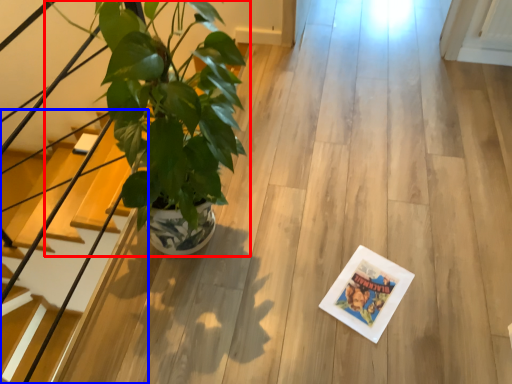
Question: Among these objects, which one is farthest to the camera, houseplant (highlighted by a red box) or stairs (highlighted by a blue box)?

Choices:
 (A) houseplant
 (B) stairs

Answer: (A)